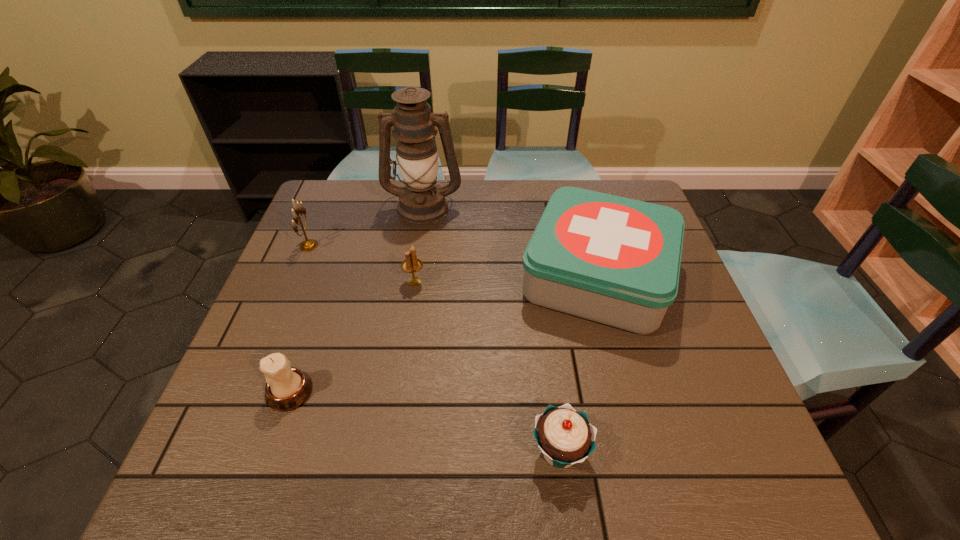
Where is `vacant area that lies between the second farthest candle holder and the oil lamp`? The height and width of the screenshot is (540, 960). vacant area that lies between the second farthest candle holder and the oil lamp is located at coordinates (419, 244).

I want to click on free point between the first-aid kit and the cupcake, so click(x=579, y=364).

Locate an element on the screen. free space between the leftmost candle holder and the first-aid kit is located at coordinates (453, 261).

Identify the location of object that is the closest one to the nearest candle holder. This screenshot has height=540, width=960. (412, 264).

Identify which object is the fourth closest to the oil lamp. Please provide its 2D coordinates. Your answer should be formatted as a tuple, i.e. [(x, y)], where the tuple contains the x and y coordinates of a point satisfying the conditions above.

[(287, 388)]

Point out which candle holder is positioned as the nearest to the first-aid kit. Please provide its 2D coordinates. Your answer should be formatted as a tuple, i.e. [(x, y)], where the tuple contains the x and y coordinates of a point satisfying the conditions above.

[(412, 264)]

Identify the location of the closest candle holder relative to the oil lamp. point(309,244).

Locate an element on the screen. This screenshot has width=960, height=540. vacant space that satisfies the following two spatial constraints: 1. on the front side of the farthest object; 2. on the right side of the cupcake is located at coordinates (386, 451).